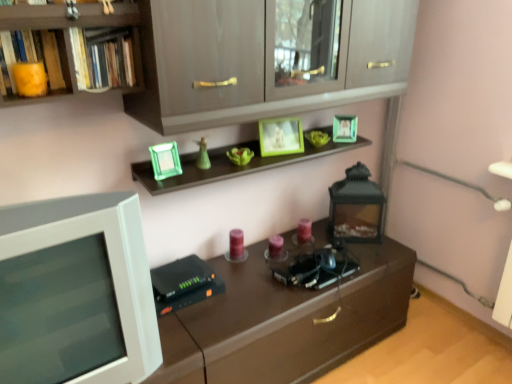
Question: Does matte yellow book at upper left, the second book viewed from the right, have a lesser height compared to hardcover books at upper left, placed as the second book when sorted from left to right?

Choices:
 (A) yes
 (B) no

Answer: (A)

Question: Is matte yellow book at upper left, placed as the 1th book when sorted from left to right, not inside hardcover books at upper left, placed as the second book when sorted from left to right?

Choices:
 (A) no
 (B) yes

Answer: (B)

Question: Is matte yellow book at upper left, placed as the 1th book when sorted from left to right, oriented away from hardcover books at upper left, placed as the second book when sorted from left to right?

Choices:
 (A) no
 (B) yes

Answer: (A)

Question: Is matte yellow book at upper left, the second book viewed from the right, positioned behind hardcover books at upper left, placed as the second book when sorted from left to right?

Choices:
 (A) no
 (B) yes

Answer: (A)

Question: Can you confirm if matte yellow book at upper left, the second book viewed from the right, is bigger than hardcover books at upper left, placed as the second book when sorted from left to right?

Choices:
 (A) yes
 (B) no

Answer: (B)

Question: Considering the relative positions of matte yellow book at upper left, the second book viewed from the right, and hardcover books at upper left, placed as the second book when sorted from left to right, in the image provided, is matte yellow book at upper left, the second book viewed from the right, to the right of hardcover books at upper left, placed as the second book when sorted from left to right, from the viewer's perspective?

Choices:
 (A) yes
 (B) no

Answer: (B)

Question: Is white plastic computer monitor at left oriented towards matte gray cabinet at upper center?

Choices:
 (A) yes
 (B) no

Answer: (B)

Question: From the image's perspective, is white plastic computer monitor at left below matte gray cabinet at upper center?

Choices:
 (A) yes
 (B) no

Answer: (A)

Question: Is the depth of white plastic computer monitor at left greater than that of matte gray cabinet at upper center?

Choices:
 (A) no
 (B) yes

Answer: (A)

Question: Does white plastic computer monitor at left contain matte gray cabinet at upper center?

Choices:
 (A) yes
 (B) no

Answer: (B)

Question: Can you confirm if white plastic computer monitor at left is bigger than matte gray cabinet at upper center?

Choices:
 (A) no
 (B) yes

Answer: (A)

Question: Is white plastic computer monitor at left far away from matte gray cabinet at upper center?

Choices:
 (A) no
 (B) yes

Answer: (A)

Question: From a real-world perspective, is matte yellow book at upper left, placed as the 1th book when sorted from left to right, below matte gray cabinet at upper center?

Choices:
 (A) no
 (B) yes

Answer: (A)